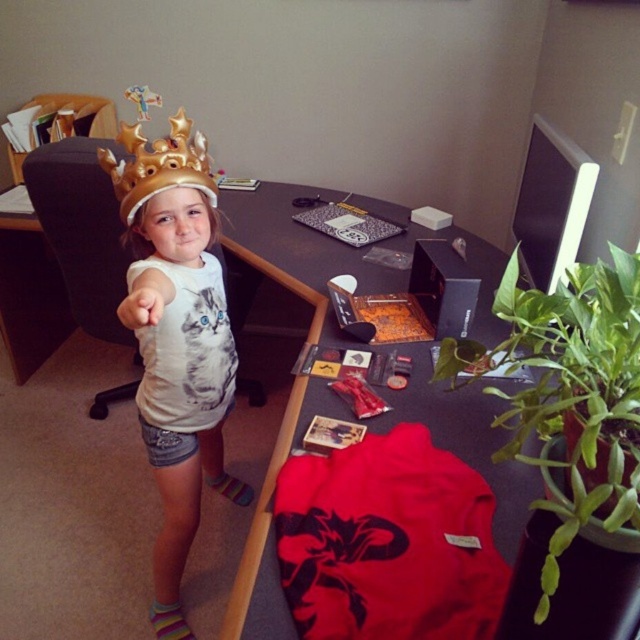
Question: Where is matte gold crown at center located in relation to gold metallic crown at upper center in the image?

Choices:
 (A) left
 (B) right

Answer: (B)

Question: Is matte gold crown at center smaller than gold metallic crown at upper center?

Choices:
 (A) no
 (B) yes

Answer: (A)

Question: Does matte gold crown at center appear under gold metallic crown at upper center?

Choices:
 (A) no
 (B) yes

Answer: (B)

Question: Which point is farther from the camera taking this photo?

Choices:
 (A) (145, 172)
 (B) (204, 282)

Answer: (B)

Question: Which object is farther from the camera taking this photo?

Choices:
 (A) gold metallic crown at upper center
 (B) matte gold crown at center

Answer: (A)